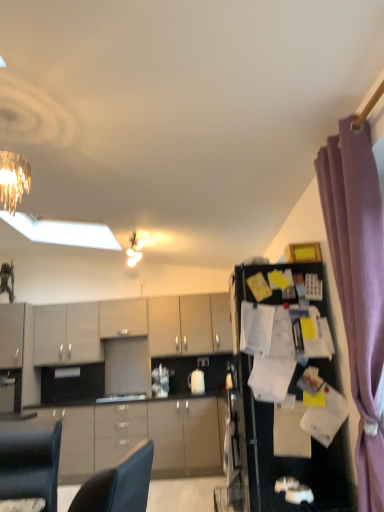
Question: In terms of width, does glossy wood cabinets at center, the 4th cabinetry in the top-to-bottom sequence, look wider or thinner when compared to white paper at right?

Choices:
 (A) thin
 (B) wide

Answer: (A)

Question: Which is correct: glossy wood cabinets at center, which is the 1th cabinetry in bottom-to-top order, is inside white paper at right, or outside of it?

Choices:
 (A) outside
 (B) inside

Answer: (A)

Question: Based on their relative distances, which object is farther from the matte gray cabinets at center, which is the 2th cabinetry from bottom to top?

Choices:
 (A) glossy wood cabinets at center, the 4th cabinetry in the top-to-bottom sequence
 (B) purple fabric curtain at right
 (C) matte gray cabinets at center, positioned as the 3th cabinetry in bottom-to-top order
 (D) matte gray cabinet at center, placed as the first cabinetry when sorted from top to bottom
 (E) metallic chandelier at upper center

Answer: (B)

Question: Based on their relative distances, which object is farther from the matte gray cabinet at center, the 4th cabinetry when ordered from bottom to top?

Choices:
 (A) metallic chandelier at upper center
 (B) glossy wood cabinets at center, the 4th cabinetry in the top-to-bottom sequence
 (C) matte gray cabinets at center, which is the 2th cabinetry from bottom to top
 (D) matte gray cabinets at center, acting as the second cabinetry starting from the top
 (E) white paper at right

Answer: (E)